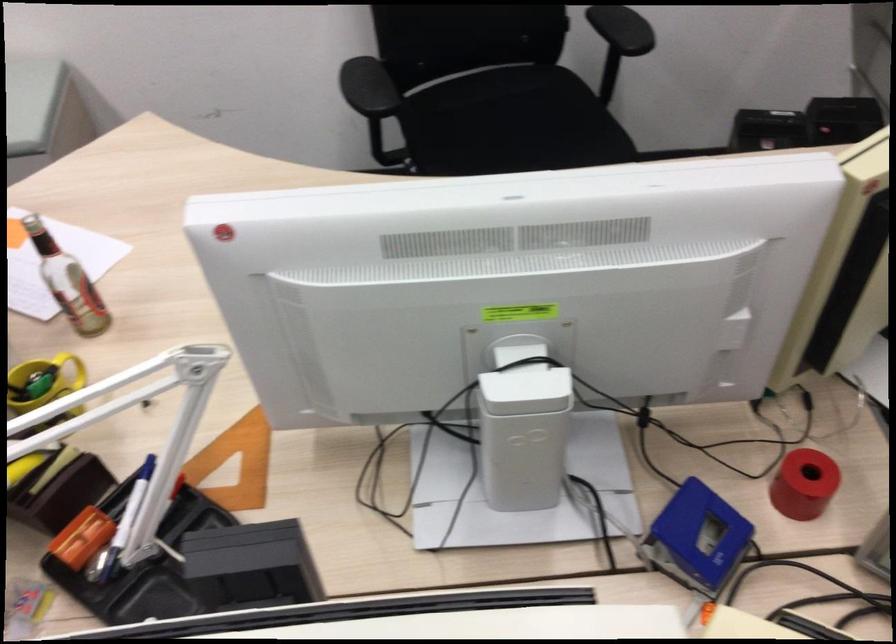
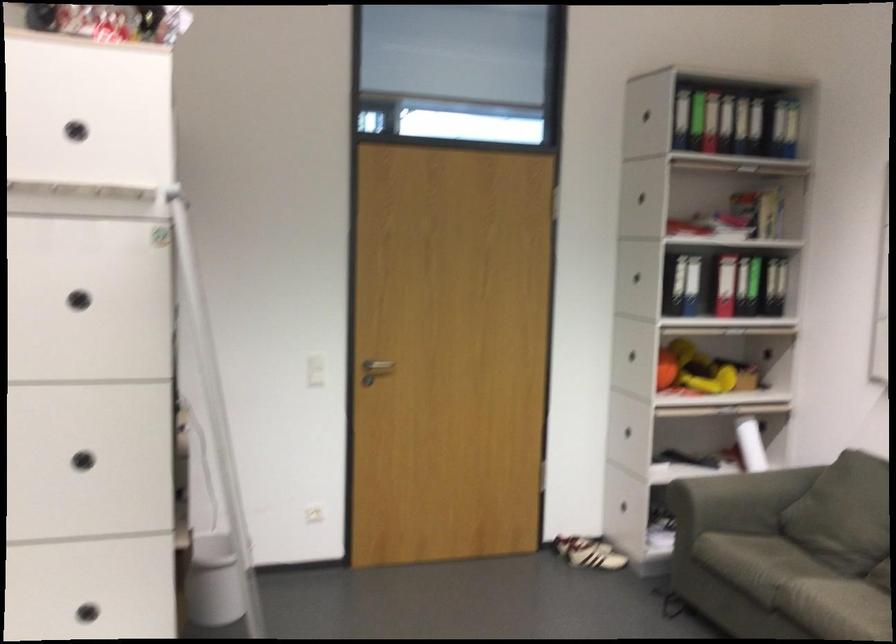
Question: How did the camera likely rotate?

Choices:
 (A) Left
 (B) Right
 (C) Up
 (D) Down

Answer: (A)